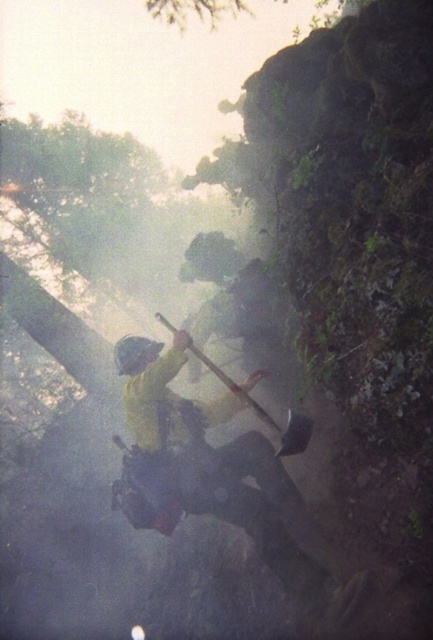
You are a hiker trying to navigate through the misty area. You see two points marked on your map corresponding to coordinates point (268,477) and point (123,362). Which point is closer to your current position if you are standing at the base of the rock face?

Point (268,477) is in front of point (123,362), so it is closer to your current position at the base of the rock face.

You are a photographer trying to capture the climber in the scene. You notice the yellow matte jacket at center and the matte yellow helmet at center. Which object should you focus on if you want to photograph the one that is more to the right?

The yellow matte jacket at center is positioned on the right side of matte yellow helmet at center, so you should focus on the yellow matte jacket at center to capture the one more to the right.

You are a photographer trying to capture the climber in the scene. You notice the yellow matte jacket at center and the matte yellow helmet at center. Which object should you focus on first if you want to ensure the closer item is sharp?

The yellow matte jacket at center is closer to the viewer than the matte yellow helmet at center, so you should focus on the yellow matte jacket at center first to ensure it is sharp.